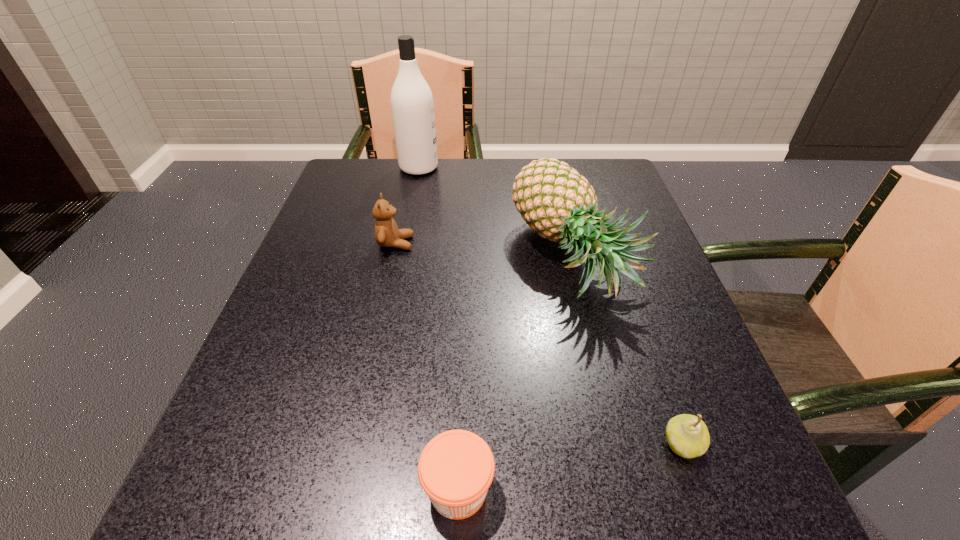
This screenshot has height=540, width=960. In order to click on free space at the near edge in this screenshot , I will do `click(357, 509)`.

Where is `free space at the left edge`? free space at the left edge is located at coordinates (275, 402).

Locate an element on the screen. free space at the right edge of the desktop is located at coordinates (663, 437).

In the image, there is a desktop. Where is `blank space at the far left corner`? The image size is (960, 540). blank space at the far left corner is located at coordinates (392, 160).

Locate an element on the screen. blank space at the far right corner is located at coordinates (605, 196).

Image resolution: width=960 pixels, height=540 pixels. Identify the location of vacant space that's between the shortest object and the fourth shortest object. pyautogui.click(x=516, y=373).

Locate an element on the screen. This screenshot has width=960, height=540. free space between the third shortest object and the jam is located at coordinates (427, 366).

In order to click on free spot between the jam and the third shortest object in this screenshot , I will do `click(427, 366)`.

I want to click on empty space that is in between the second shortest object and the jam, so click(x=570, y=467).

Image resolution: width=960 pixels, height=540 pixels. What are the coordinates of `free space that is in between the fourth shortest object and the third shortest object` in the screenshot? It's located at (485, 250).